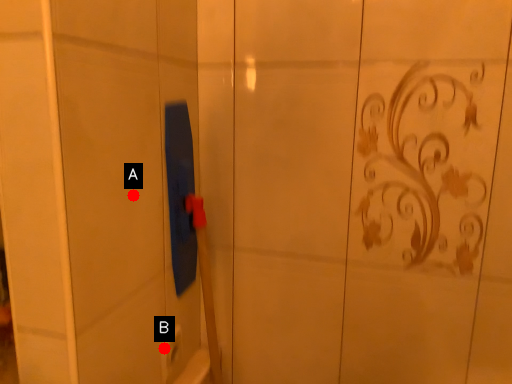
Question: Two points are circled on the image, labeled by A and B beside each circle. Among these points, which one is farthest from the camera?

Choices:
 (A) A is further
 (B) B is further

Answer: (B)